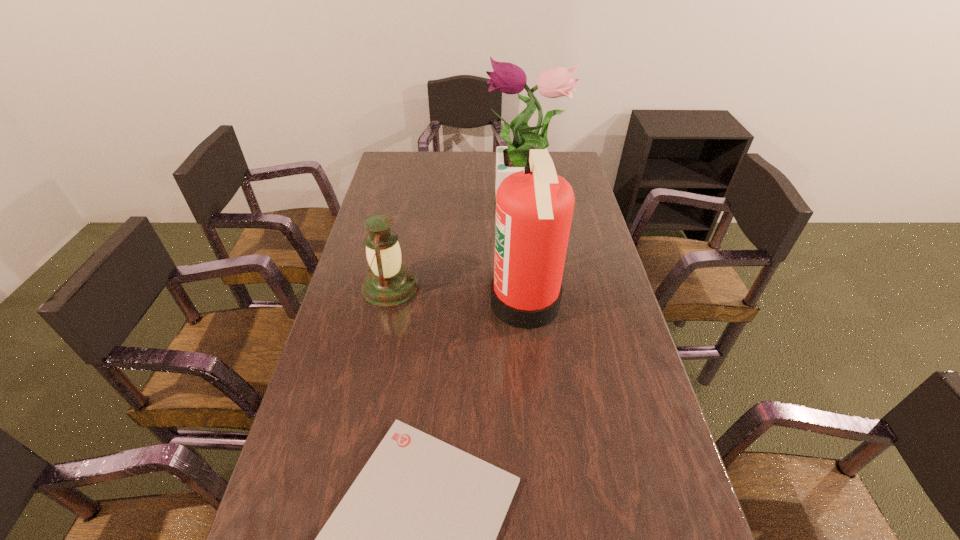
Locate which object is the second closest to the fire extinguisher. Please provide its 2D coordinates. Your answer should be formatted as a tuple, i.e. [(x, y)], where the tuple contains the x and y coordinates of a point satisfying the conditions above.

[(414, 538)]